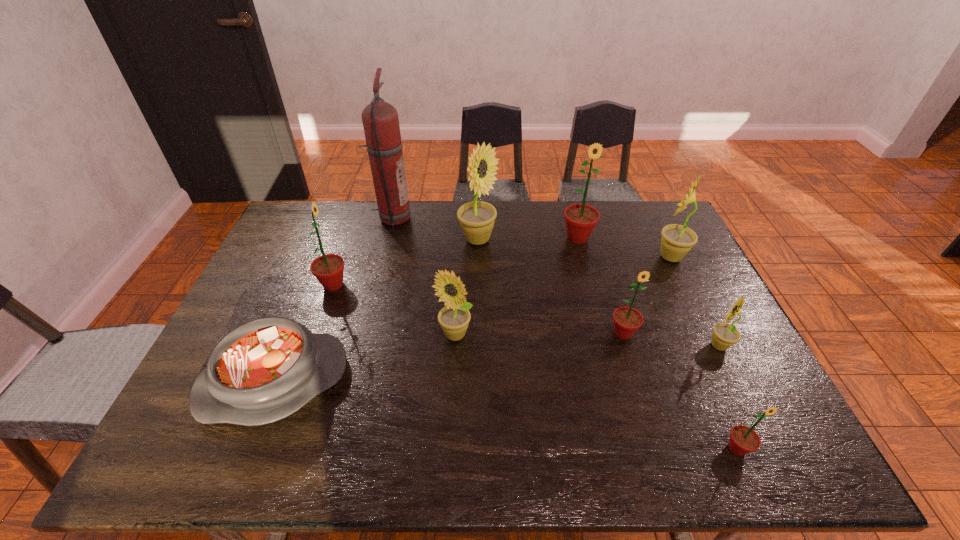
Where is `the smallest green sunflower`? This screenshot has height=540, width=960. the smallest green sunflower is located at coordinates coord(743,439).

This screenshot has width=960, height=540. Identify the location of the nearest green sunflower. (743, 439).

This screenshot has height=540, width=960. What are the coordinates of `the shortest object` in the screenshot? It's located at (264, 370).

Image resolution: width=960 pixels, height=540 pixels. Find the location of `gray casserole`. gray casserole is located at coordinates (264, 370).

Where is `vacant space located on the side of the fire extinguisher with the label and nozzle`? Image resolution: width=960 pixels, height=540 pixels. vacant space located on the side of the fire extinguisher with the label and nozzle is located at coordinates (425, 219).

Where is `vacant space located 0.210m on the face of the biggest yellow sunflower`? vacant space located 0.210m on the face of the biggest yellow sunflower is located at coordinates (559, 240).

Identify the location of free spot located on the face of the farthest green sunflower. This screenshot has width=960, height=540. (594, 300).

Where is `vacant space located on the face of the second biggest yellow sunflower`? vacant space located on the face of the second biggest yellow sunflower is located at coordinates (547, 257).

At what (x,y) coordinates should I click in order to perform the action: click on vacant space located 0.190m on the face of the second biggest yellow sunflower. Please return your answer as a coordinate pair (x, y). This screenshot has width=960, height=540. Looking at the image, I should click on (595, 257).

Image resolution: width=960 pixels, height=540 pixels. Find the location of `free spot located 0.260m on the face of the second biggest yellow sunflower`. free spot located 0.260m on the face of the second biggest yellow sunflower is located at coordinates (574, 257).